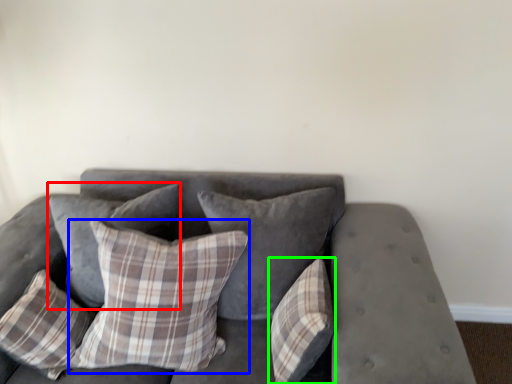
Question: Estimate the real-world distances between objects in this image. Which object is farther from pillow (highlighted by a red box), pillow (highlighted by a blue box) or pillow (highlighted by a green box)?

Choices:
 (A) pillow
 (B) pillow

Answer: (B)